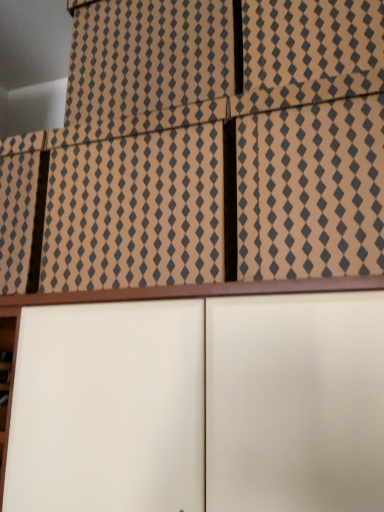
You are a GUI agent. You are given a task and a screenshot of the screen. Output one action in this format:
    pyautogui.click(x=<x>, y=<y>)
    Task: Click on the white matte cabinet at bottom
    
    Given the screenshot: What is the action you would take?
    pyautogui.click(x=108, y=408)

What is the approximate width of white matte cabinet at bottom?

It is 13.44 inches.

What do you see at coordinates (108, 408) in the screenshot?
I see `white matte cabinet at bottom` at bounding box center [108, 408].

Locate an element on the screen. The image size is (384, 512). white matte cabinet at bottom is located at coordinates (108, 408).